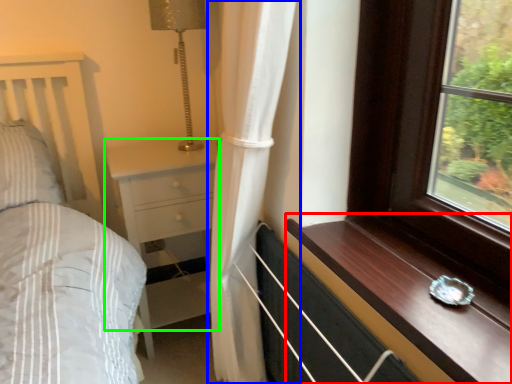
Question: Estimate the real-world distances between objects in this image. Which object is closer to window sill (highlighted by a red box), curtain (highlighted by a blue box) or chest of drawers (highlighted by a green box)?

Choices:
 (A) curtain
 (B) chest of drawers

Answer: (A)